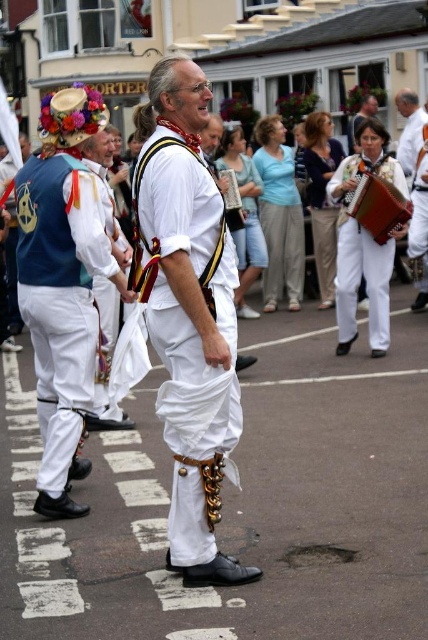
Question: Is white matte pants at center bigger than white cotton accordion at center?

Choices:
 (A) yes
 (B) no

Answer: (A)

Question: Which object is positioned closest to the white cotton accordion at center?

Choices:
 (A) matte blue vest at center
 (B) white matte pants at center

Answer: (B)

Question: In this image, where is matte blue vest at center located relative to white cotton accordion at center?

Choices:
 (A) left
 (B) right

Answer: (A)

Question: Which of these objects is positioned closest to the white matte pants at center?

Choices:
 (A) matte blue vest at center
 (B) white cotton accordion at center

Answer: (A)

Question: Which point is farther to the camera?

Choices:
 (A) white cotton accordion at center
 (B) white matte pants at center
 (C) matte blue vest at center

Answer: (A)

Question: Is the position of white matte pants at center more distant than that of matte blue vest at center?

Choices:
 (A) no
 (B) yes

Answer: (A)